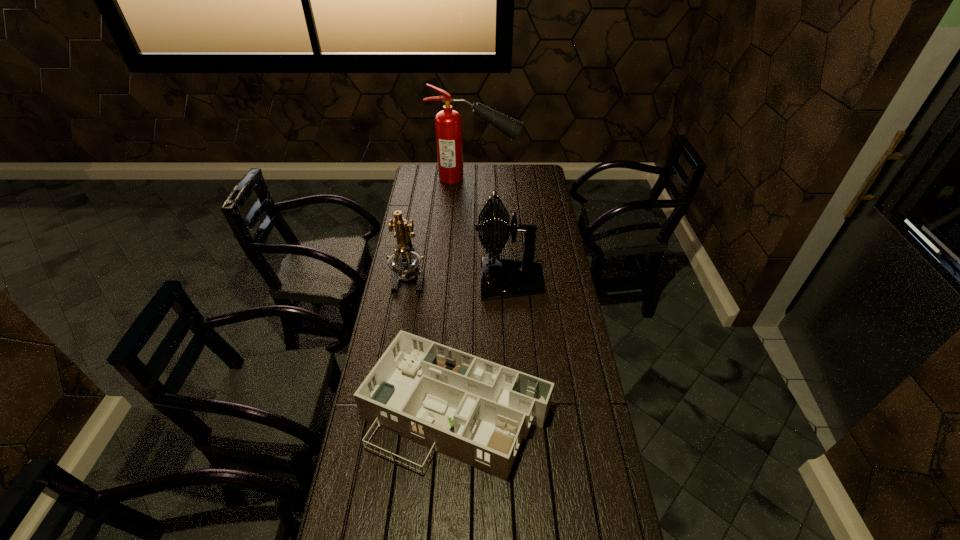
The height and width of the screenshot is (540, 960). I want to click on object that is positioned at the far right corner, so click(x=448, y=123).

The height and width of the screenshot is (540, 960). In the image, there is a desktop. In order to click on vacant space at the far edge in this screenshot , I will do `click(484, 171)`.

In the image, there is a desktop. Identify the location of vacant region at the left edge. (416, 300).

At what (x,y) coordinates should I click in order to perform the action: click on vacant position at the right edge of the desktop. Please return your answer as a coordinate pair (x, y). This screenshot has width=960, height=540. Looking at the image, I should click on (541, 255).

Where is `vacant space that's between the tallest object and the microscope`? Image resolution: width=960 pixels, height=540 pixels. vacant space that's between the tallest object and the microscope is located at coordinates (442, 228).

You are a GUI agent. You are given a task and a screenshot of the screen. Output one action in this format:
    pyautogui.click(x=<x>, y=<y>)
    Task: Click on the free spot between the fan and the nearest object
    The height and width of the screenshot is (540, 960).
    Given the screenshot: What is the action you would take?
    pyautogui.click(x=483, y=346)

The height and width of the screenshot is (540, 960). Identify the location of free space between the fan and the second shortest object. (459, 280).

This screenshot has height=540, width=960. Find the location of `vacant area between the dollhouse and the farthest object`. vacant area between the dollhouse and the farthest object is located at coordinates (466, 294).

Identify the location of the closest object to the farthest object. pos(500,278).

Find the location of a particular element. The image size is (960, 540). object that stands as the closest to the fan is located at coordinates (404, 262).